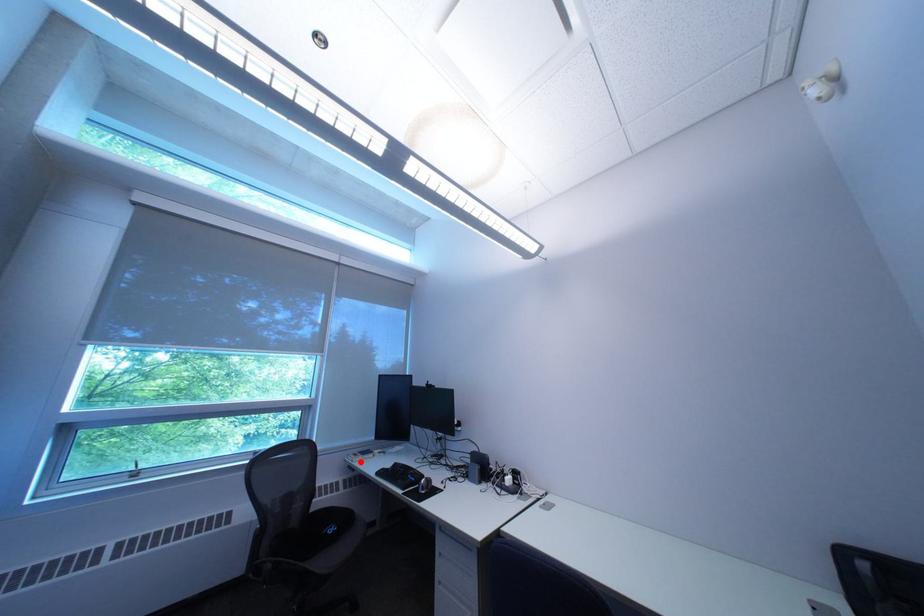
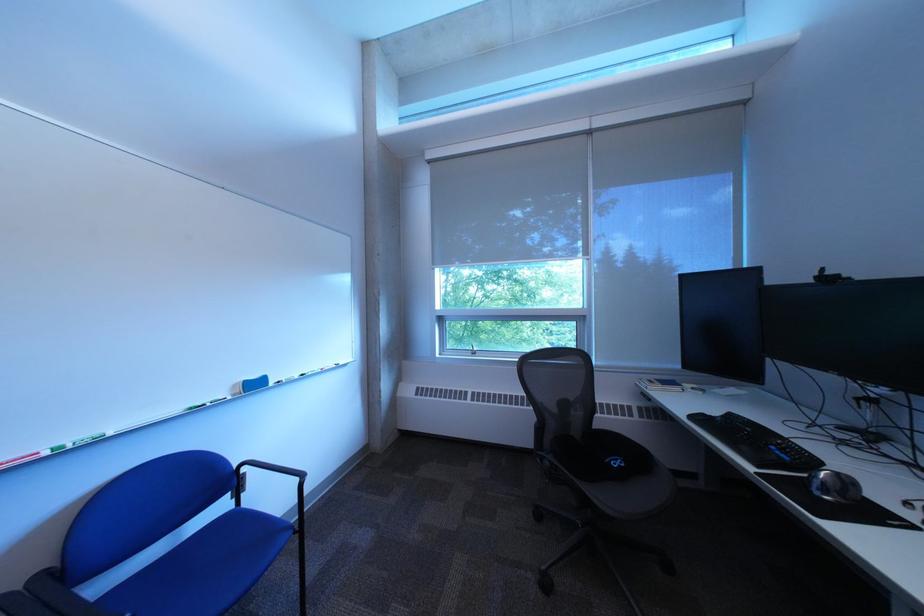
The point at the highlighted location is marked in the first image. Where is the corresponding point in the second image?

(651, 386)